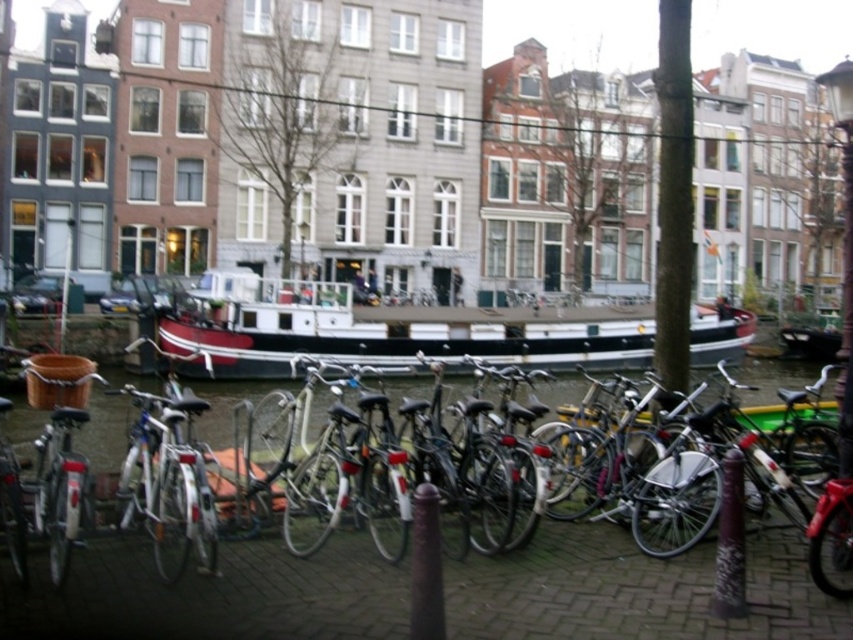
You are a delivery person who needs to transport a large package that requires a minimum width of 1.2 meters. You have the option to use either the white glossy boat at center or the shiny silver bicycle at center. Based on their widths, which one can accommodate your package?

The shiny silver bicycle at center is wider than the white glossy boat at center. Since the boat is thinner, the shiny silver bicycle at center can accommodate the package as it meets the minimum width requirement of 1.2 meters.